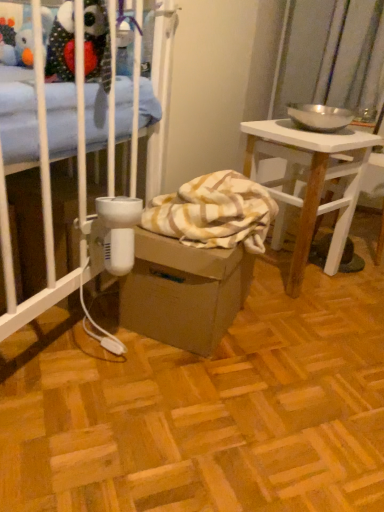
At what (x,y) coordinates should I click in order to perform the action: click on free space between white wood desk at right and brown cardboard box at center. Please return your answer as a coordinate pair (x, y). Image resolution: width=384 pixels, height=512 pixels. Looking at the image, I should click on (266, 317).